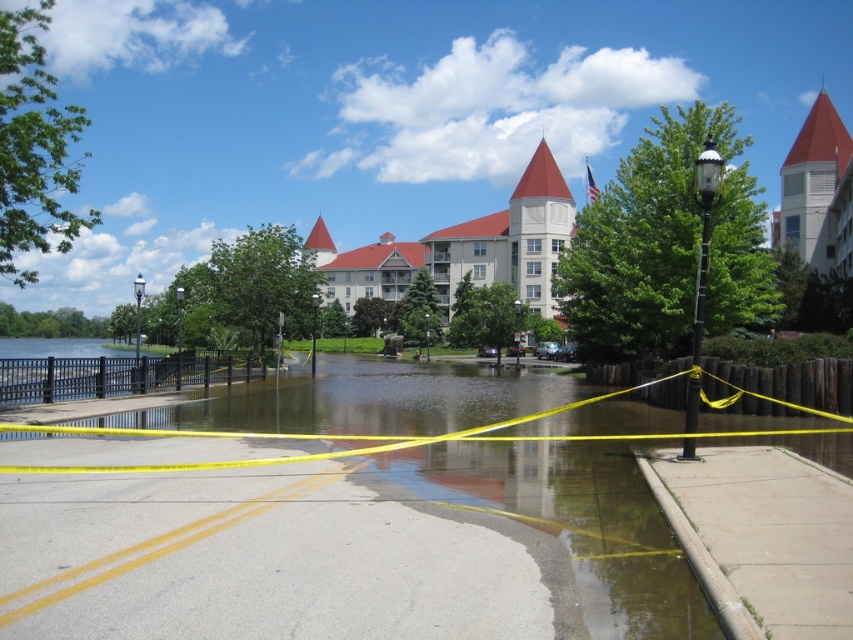
Question: Which of the following is the farthest from the observer?

Choices:
 (A) matte red tower at upper right
 (B) yellow plastic tape at center
 (C) beige stone hotel at center
 (D) gray concrete sidewalk at lower right

Answer: (C)

Question: Which of the following is the farthest from the observer?

Choices:
 (A) matte red tower at upper right
 (B) yellow plastic tape at center
 (C) beige stone hotel at center

Answer: (C)

Question: Can you confirm if gray concrete sidewalk at lower right is positioned to the right of matte red tower at upper right?

Choices:
 (A) yes
 (B) no

Answer: (B)

Question: Can you confirm if gray concrete pavement at lower center is smaller than gray concrete sidewalk at lower right?

Choices:
 (A) no
 (B) yes

Answer: (B)

Question: Observing the image, what is the correct spatial positioning of yellow plastic tape at center in reference to gray concrete sidewalk at lower right?

Choices:
 (A) right
 (B) left

Answer: (B)

Question: Among these points, which one is nearest to the camera?

Choices:
 (A) (804, 241)
 (B) (463, 269)

Answer: (A)